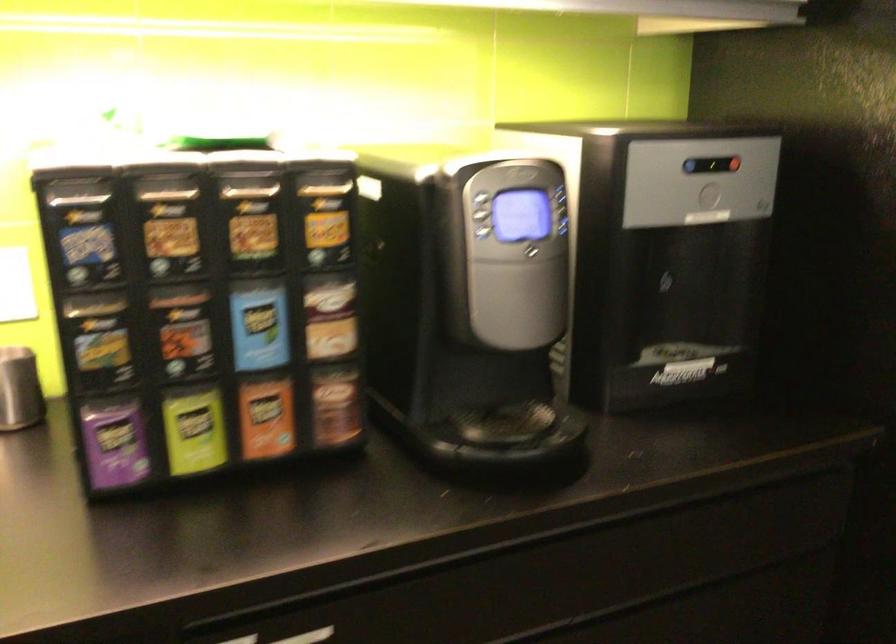
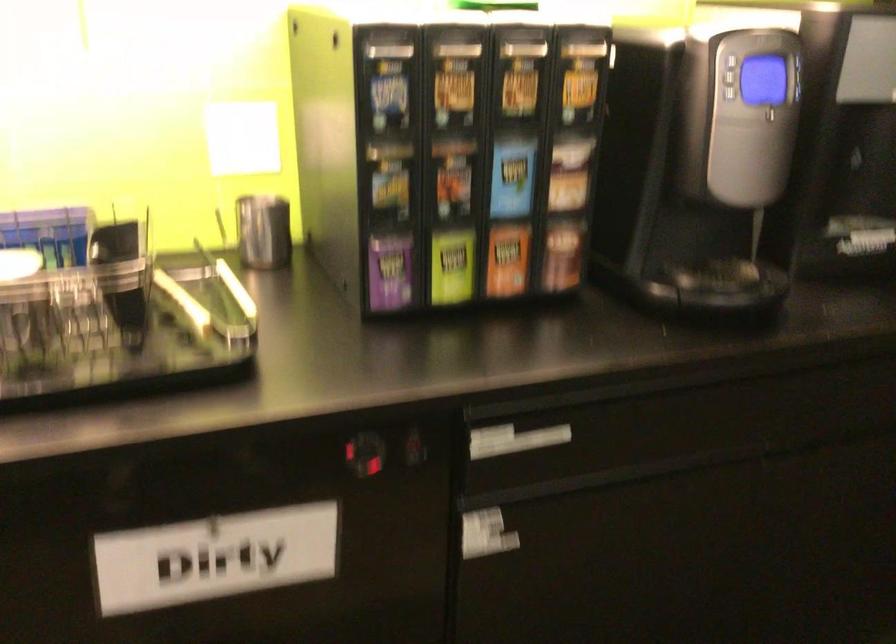
Which direction would the cameraman need to move to produce the second image?

The cameraman moved toward left, backward.